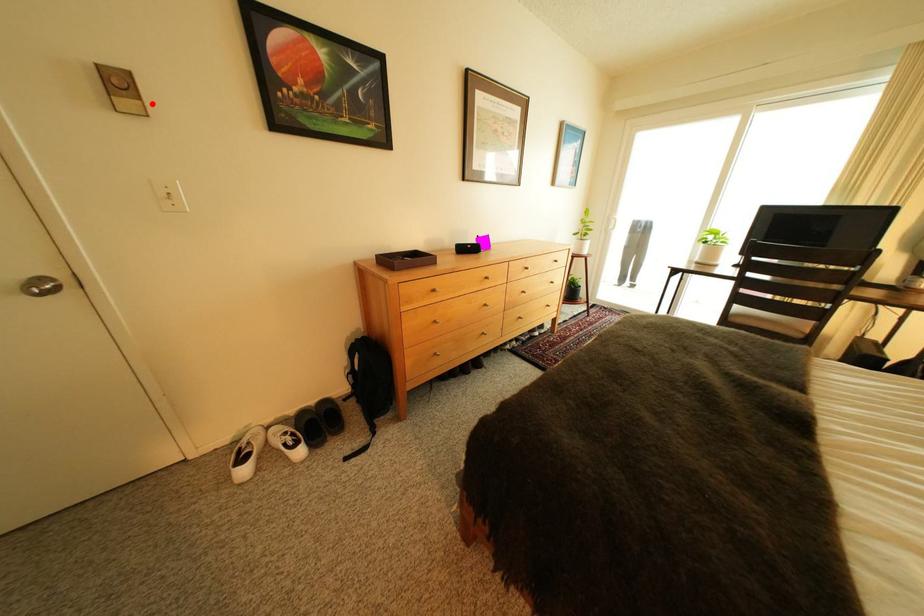
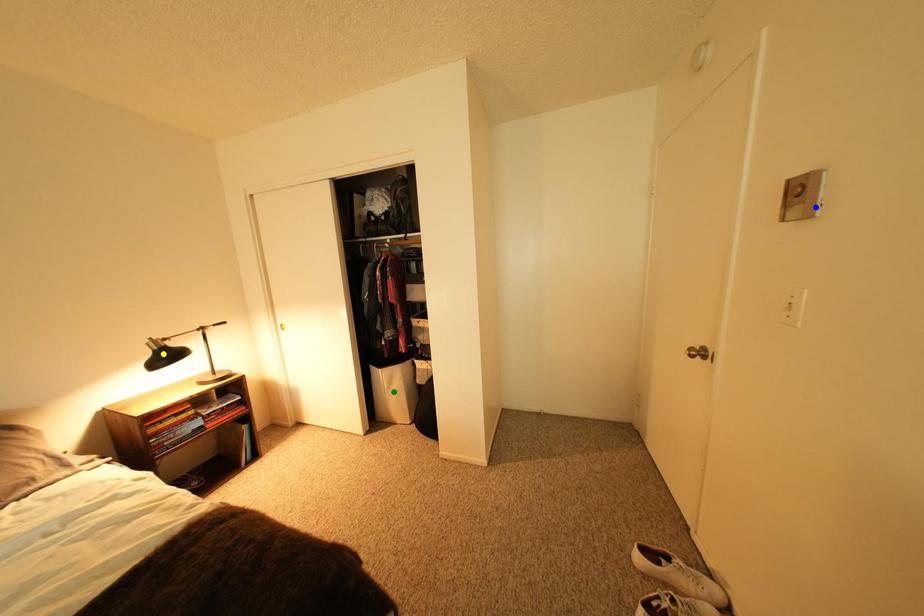
Question: I am providing you with two images of the same scene from different viewpoints. A red point is marked on the first image. You are given multiple points on the second image. Which spot in image 2 lines up with the point in image 1?

Choices:
 (A) green point
 (B) yellow point
 (C) blue point

Answer: (C)